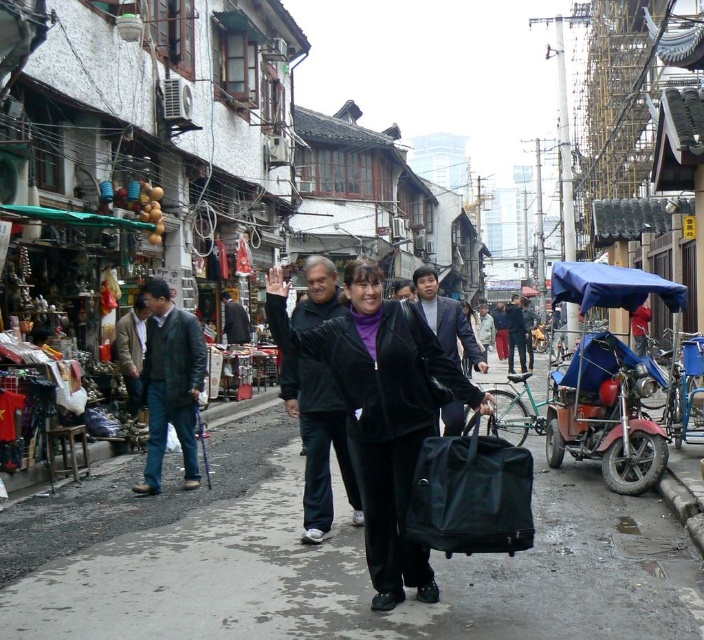
Question: Is black leather bag at center wider than dark gray suit at center?

Choices:
 (A) yes
 (B) no

Answer: (B)

Question: Estimate the real-world distances between objects in this image. Which object is farther from the black matte jacket at center?

Choices:
 (A) dark brown leather jacket at left
 (B) dark blue jeans at left

Answer: (A)

Question: Which of the following is the closest to the observer?

Choices:
 (A) black matte jacket at center
 (B) dark brown leather jacket at left

Answer: (A)

Question: Which object appears farthest from the camera in this image?

Choices:
 (A) black matte jacket at center
 (B) black leather bag at center
 (C) dark brown leather jacket at left
 (D) black velvety jacket at center

Answer: (C)

Question: Does dark blue jeans at left appear over dark gray jacket at center?

Choices:
 (A) no
 (B) yes

Answer: (A)

Question: Considering the relative positions of black matte jacket at center and dark gray jacket at center in the image provided, where is black matte jacket at center located with respect to dark gray jacket at center?

Choices:
 (A) left
 (B) right

Answer: (A)